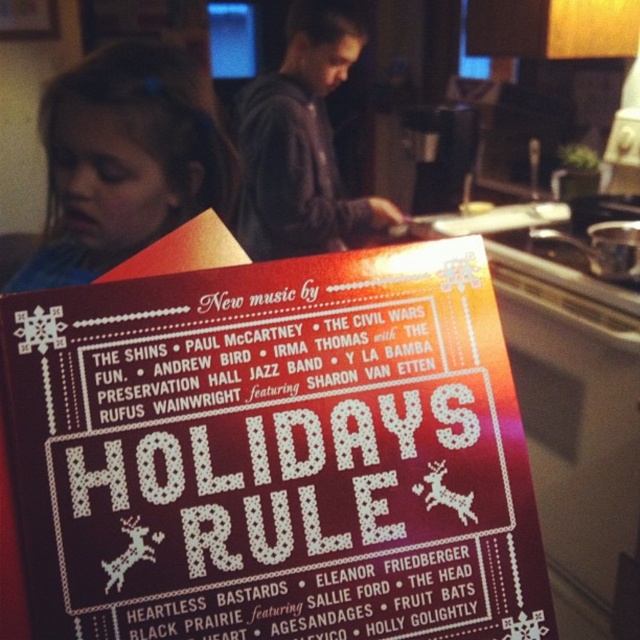
Consider the image. Does matte paper poster at center have a greater height compared to metallic silver pot at upper right?

Yes.

Which is in front, point (515, 412) or point (476, 209)?

Positioned in front is point (515, 412).

You are a GUI agent. You are given a task and a screenshot of the screen. Output one action in this format:
    pyautogui.click(x=<x>, y=<y>)
    Task: Click on the matte paper poster at center
    This screenshot has height=640, width=640.
    Given the screenshot: What is the action you would take?
    (275, 454)

Does matte blue hair at upper left appear over metallic silver pot at upper right?

Indeed, matte blue hair at upper left is positioned over metallic silver pot at upper right.

Is matte blue hair at upper left to the right of metallic silver pot at upper right from the viewer's perspective?

No, matte blue hair at upper left is not to the right of metallic silver pot at upper right.

Image resolution: width=640 pixels, height=640 pixels. Identify the location of matte blue hair at upper left. (124, 161).

Does matte paper poster at center have a lesser height compared to matte blue hair at upper left?

Indeed, matte paper poster at center has a lesser height compared to matte blue hair at upper left.

Is the position of matte paper poster at center more distant than that of matte blue hair at upper left?

No, matte paper poster at center is closer to the viewer.

Between point (296, 438) and point (224, 193), which one is positioned in front?

Positioned in front is point (296, 438).

Identify the location of matte paper poster at center. (275, 454).